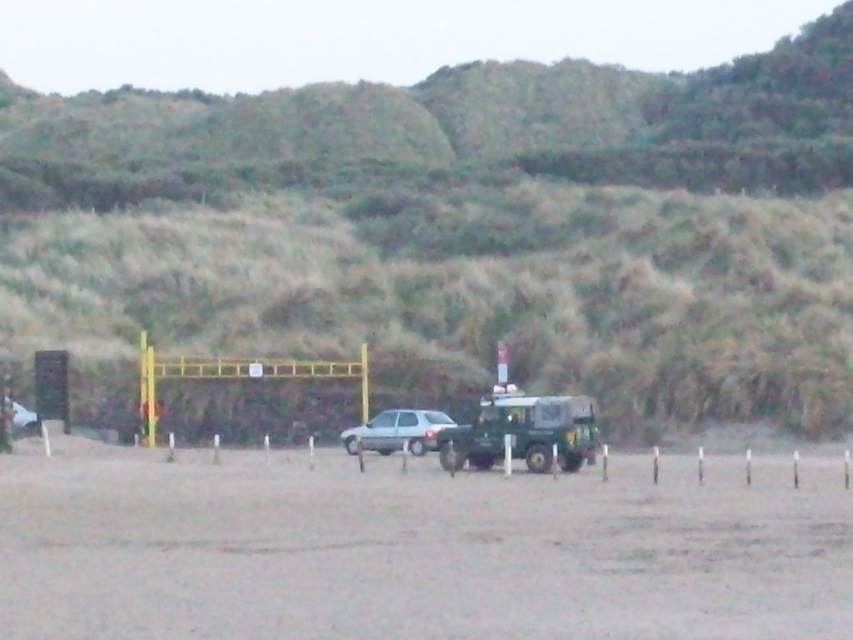
The image size is (853, 640). What do you see at coordinates (418, 547) in the screenshot?
I see `gray sand at center` at bounding box center [418, 547].

Between gray sand at center and green matte jeep at center, which one has less height?

With less height is green matte jeep at center.

Locate an element on the screen. Image resolution: width=853 pixels, height=640 pixels. gray sand at center is located at coordinates (418, 547).

Identify the location of gray sand at center. (418, 547).

You are a GUI agent. You are given a task and a screenshot of the screen. Output one action in this format:
    pyautogui.click(x=<x>, y=<y>)
    Task: Click on the green grassy hillside at upper center
    
    Given the screenshot: What is the action you would take?
    pyautogui.click(x=457, y=230)

Measure the distance from green grassy hillside at upper center to satin silver car at center.

The distance of green grassy hillside at upper center from satin silver car at center is 58.95 meters.

Is point (747, 67) farther from viewer compared to point (374, 433)?

Yes, point (747, 67) is behind point (374, 433).

Locate an element on the screen. This screenshot has height=640, width=853. green grassy hillside at upper center is located at coordinates (457, 230).

From the picture: Does green grassy hillside at upper center appear on the left side of green matte jeep at center?

Incorrect, green grassy hillside at upper center is not on the left side of green matte jeep at center.

Is point (183, 122) in front of point (448, 436)?

No.

Locate an element on the screen. The height and width of the screenshot is (640, 853). green grassy hillside at upper center is located at coordinates (457, 230).